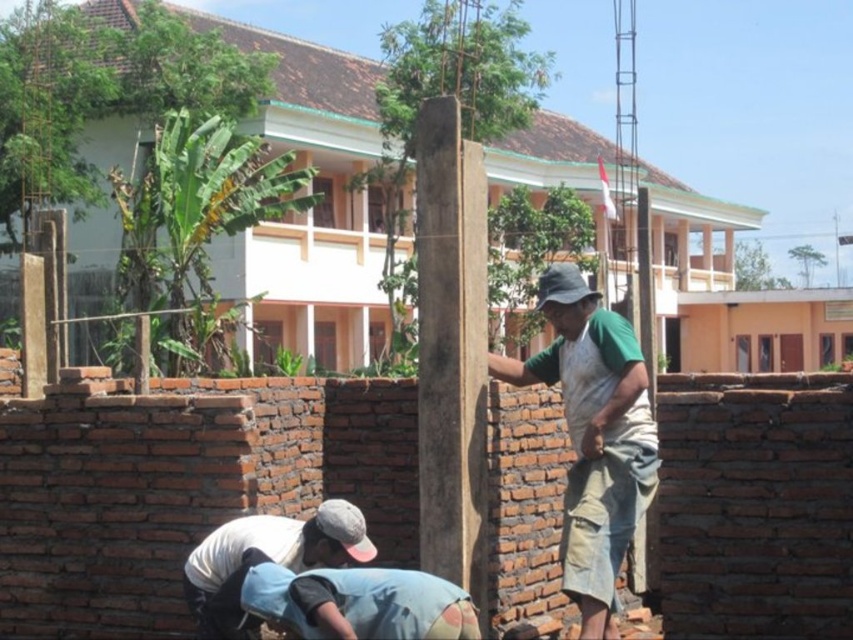
This screenshot has height=640, width=853. What do you see at coordinates (265, 561) in the screenshot? I see `denim cap at lower center` at bounding box center [265, 561].

Who is lower down, denim cap at lower center or blue denim jeans at lower center?

blue denim jeans at lower center is lower down.

Is point (212, 573) closer to camera compared to point (352, 588)?

No, (212, 573) is behind (352, 588).

Locate an element on the screen. Image resolution: width=853 pixels, height=640 pixels. denim cap at lower center is located at coordinates (265, 561).

Is green fabric apron at center taller than blue denim jeans at lower center?

Yes, green fabric apron at center is taller than blue denim jeans at lower center.

Is green fabric apron at center shorter than blue denim jeans at lower center?

In fact, green fabric apron at center may be taller than blue denim jeans at lower center.

Is point (654, 468) positioned before point (409, 586)?

No, it is not.

Where is `green fabric apron at center`? green fabric apron at center is located at coordinates click(593, 436).

Does green fabric apron at center appear on the left side of denim cap at lower center?

Incorrect, green fabric apron at center is not on the left side of denim cap at lower center.

Does point (579, 400) come in front of point (259, 522)?

No, it is behind (259, 522).

Who is more distant from viewer, (x=607, y=515) or (x=199, y=582)?

The point (x=607, y=515) is behind.

Where is `green fabric apron at center`? This screenshot has width=853, height=640. green fabric apron at center is located at coordinates (593, 436).